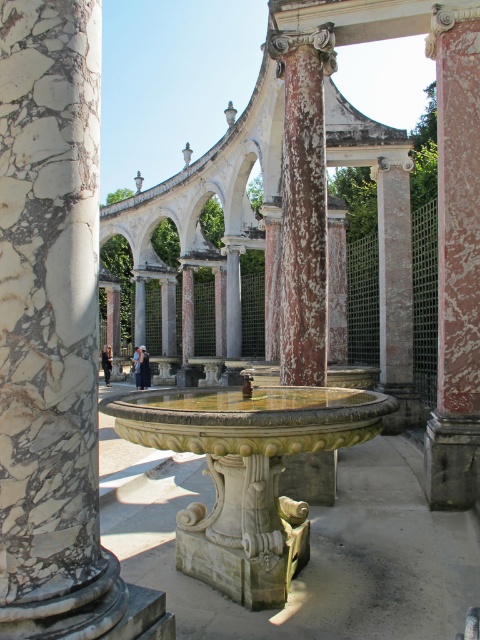
This screenshot has width=480, height=640. What do you see at coordinates (55, 337) in the screenshot?
I see `marble column at center` at bounding box center [55, 337].

Which of these two, marble column at center or stone fountain at center, stands taller?

marble column at center is taller.

What do you see at coordinates (55, 337) in the screenshot? This screenshot has height=640, width=480. I see `marble column at center` at bounding box center [55, 337].

Find the location of a particular element. marble column at center is located at coordinates (55, 337).

Can you confirm if marble column at center is thinner than speckled stone column at center?

Yes, marble column at center is thinner than speckled stone column at center.

Between marble column at center and speckled stone column at center, which one appears on the left side from the viewer's perspective?

marble column at center is more to the left.

In order to click on marble column at center in this screenshot , I will do `click(55, 337)`.

Where is `marble column at center`? This screenshot has width=480, height=640. marble column at center is located at coordinates (55, 337).

Is stone fountain at center further to the viewer compared to rustic pink stone column at center?

That is False.

Does stone fountain at center have a larger size compared to rustic pink stone column at center?

Actually, stone fountain at center might be smaller than rustic pink stone column at center.

You are a GUI agent. You are given a task and a screenshot of the screen. Output one action in this format:
    pyautogui.click(x=<x>, y=<y>)
    Task: Click on the stone fountain at center
    The image size is (480, 640).
    Given the screenshot: What is the action you would take?
    pyautogui.click(x=247, y=472)